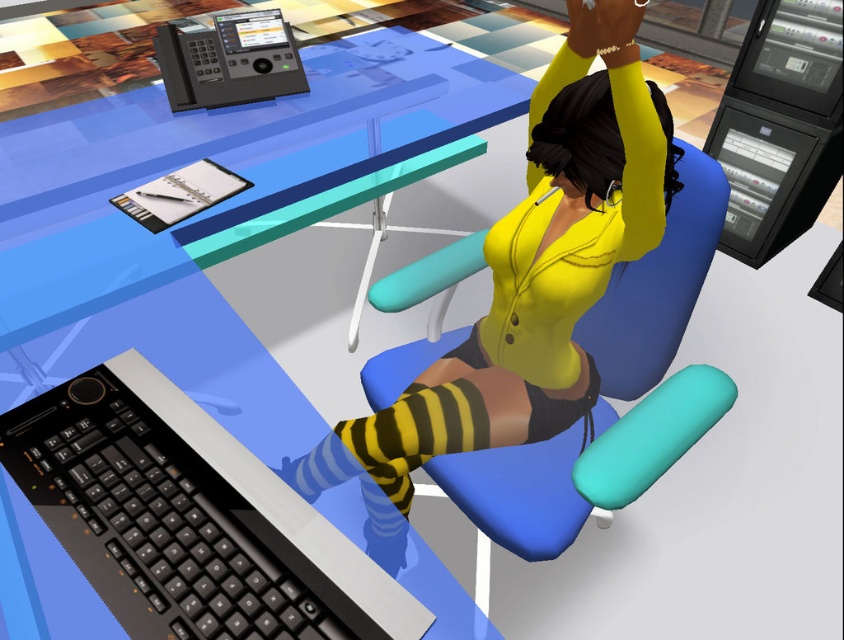
Question: Can you confirm if black plastic keyboard at lower left is positioned to the right of blue fabric chair at center?

Choices:
 (A) no
 (B) yes

Answer: (A)

Question: Can you confirm if blue fabric chair at center is thinner than black plastic phone at upper left?

Choices:
 (A) yes
 (B) no

Answer: (B)

Question: Which point is farther to the camera?

Choices:
 (A) (433, 276)
 (B) (155, 493)

Answer: (A)

Question: Considering the real-world distances, which object is closest to the blue plastic table at center?

Choices:
 (A) black plastic phone at upper left
 (B) black plastic keyboard at lower left

Answer: (A)

Question: Which point is closer to the camera?

Choices:
 (A) (47, 332)
 (B) (615, 506)

Answer: (B)

Question: Is blue plastic table at center positioned behind black plastic phone at upper left?

Choices:
 (A) yes
 (B) no

Answer: (B)